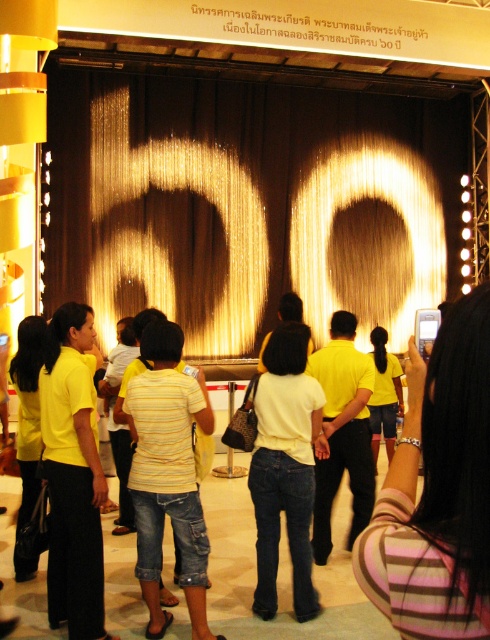
Question: Which object appears closest to the camera in this image?

Choices:
 (A) yellow striped shirt at center
 (B) striped fabric dress at center
 (C) yellow fabric shorts at center
 (D) light yellow shirt at center

Answer: (B)

Question: Can you confirm if striped fabric dress at center is positioned above yellow striped shirt at center?

Choices:
 (A) yes
 (B) no

Answer: (A)

Question: Which point is closer to the camera?

Choices:
 (A) yellow striped shirt at center
 (B) yellow fabric shorts at center

Answer: (A)

Question: Is yellow striped shirt at center below matte yellow shirt at center?

Choices:
 (A) yes
 (B) no

Answer: (A)

Question: Estimate the real-world distances between objects in this image. Which object is closer to the matte yellow shirt at center?

Choices:
 (A) striped fabric dress at center
 (B) light yellow shirt at center
 (C) yellow fabric shorts at center

Answer: (B)

Question: Does yellow striped shirt at center appear under matte yellow shirt at center?

Choices:
 (A) no
 (B) yes

Answer: (B)